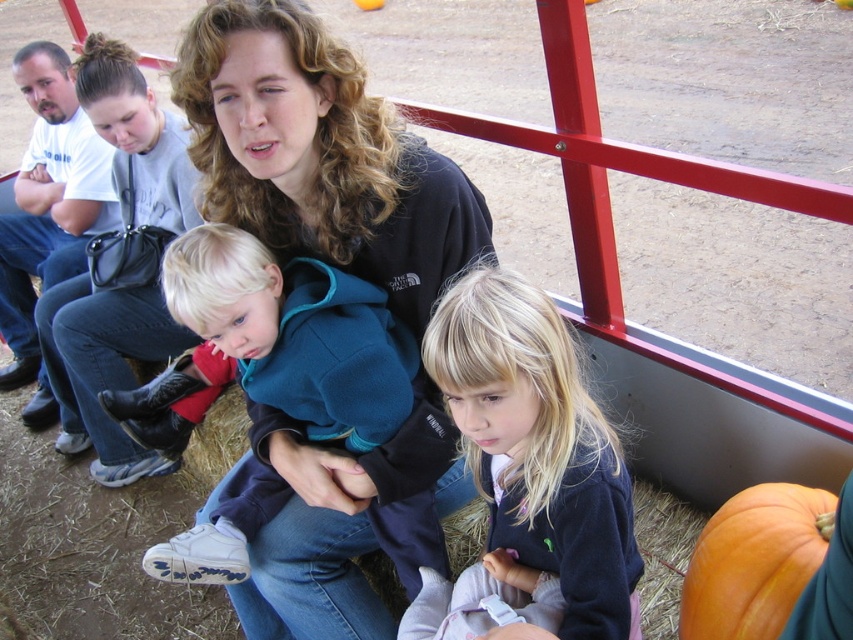
Is black fleece at center in front of black leather purse at upper left?

Yes, black fleece at center is closer to the viewer.

Between black fleece at center and black leather purse at upper left, which one appears on the right side from the viewer's perspective?

black fleece at center is more to the right.

Who is more distant from viewer, (292, 524) or (44, 288)?

Point (44, 288)

Locate an element on the screen. This screenshot has height=640, width=853. black fleece at center is located at coordinates (344, 272).

Consider the image. Measure the distance between point (47, 420) and camera.

Point (47, 420) and camera are 3.48 meters apart from each other.

Consider the image. Can you confirm if black leather purse at upper left is thinner than orange matte pumpkin at lower right?

No.

Who is more distant from viewer, (x=64, y=164) or (x=786, y=513)?

Point (x=64, y=164)

This screenshot has height=640, width=853. In order to click on black leather purse at upper left in this screenshot , I will do `click(48, 212)`.

Does red denim boot at left appear under black leather purse at upper left?

Yes.

From the picture: Is red denim boot at left closer to the viewer compared to black leather purse at upper left?

Yes, red denim boot at left is closer to the viewer.

Who is more forward, (61,348) or (107,220)?

Point (61,348) is more forward.

The width and height of the screenshot is (853, 640). In order to click on red denim boot at left in this screenshot , I will do `click(103, 368)`.